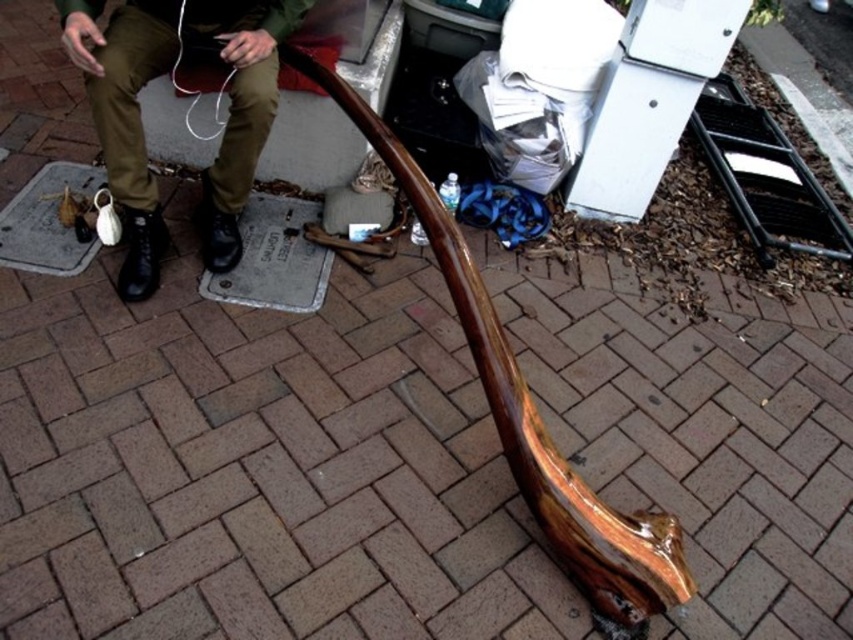
You are a photographer trying to capture a closeup of the glossy wood sculpture at center and the matte olive green pants at lower left in the same frame. Which object should you move closer to the camera to ensure both are in focus?

The glossy wood sculpture at center is positioned on the right side of matte olive green pants at lower left. To ensure both are in focus, you should move the matte olive green pants at lower left closer to the camera so they are at the same distance as the glossy wood sculpture at center.

You are a delivery person who needs to place a package on the glossy wood sculpture at center. Considering the height of the matte olive green pants at lower left, can you estimate if the sculpture is tall enough to safely place the package without it falling over?

The glossy wood sculpture at center has a greater height compared to the matte olive green pants at lower left. Since the sculpture is taller, it should be stable enough to place the package on it without it falling over.

You are a delivery person who needs to place a small package on the ground near the glossy wood sculpture at center. However, there is a matte olive green pants at lower left nearby. Considering their sizes, can you safely place the package between them without it overlapping either object?

The glossy wood sculpture at center is larger in size than the matte olive green pants at lower left. Since the sculpture is bigger, there should be enough space between them to place the package without overlapping either object.